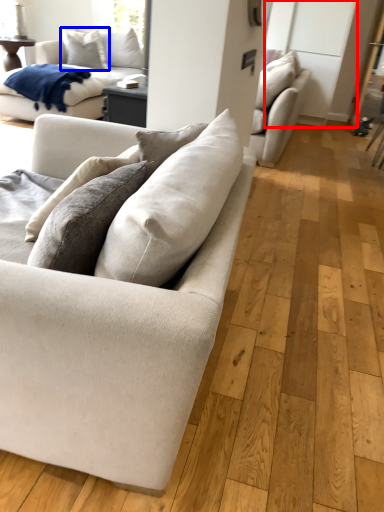
Question: Which object appears closest to the camera in this image, glass door (highlighted by a red box) or pillow (highlighted by a blue box)?

Choices:
 (A) glass door
 (B) pillow

Answer: (A)